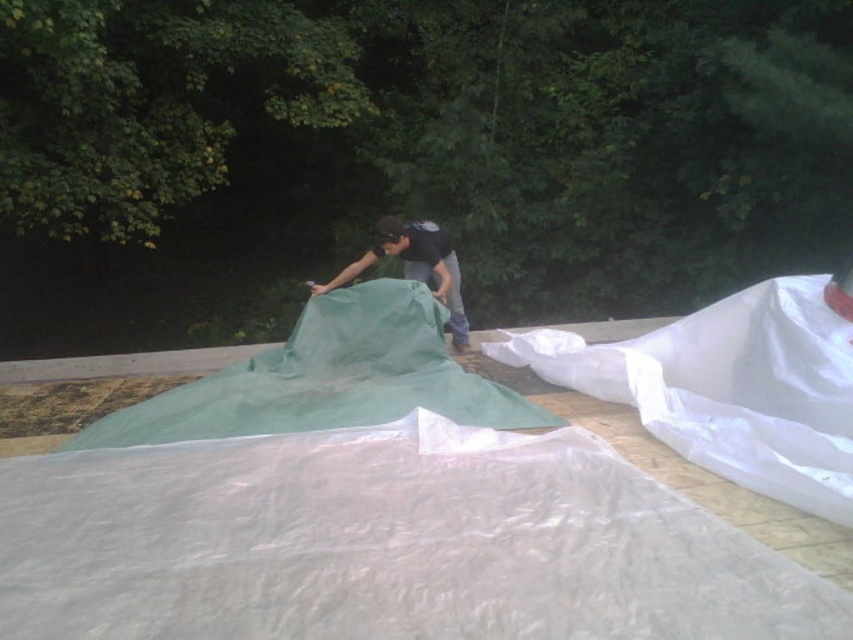
Question: Is white translucent sheet at right positioned behind green fabric blanket at center?

Choices:
 (A) no
 (B) yes

Answer: (A)

Question: Considering the relative positions of white translucent sheet at right and matte green tarp at center in the image provided, where is white translucent sheet at right located with respect to matte green tarp at center?

Choices:
 (A) above
 (B) below

Answer: (B)

Question: Among these points, which one is farthest from the camera?

Choices:
 (A) (276, 362)
 (B) (350, 266)

Answer: (B)

Question: Does white translucent sheet at right have a lesser width compared to green fabric blanket at center?

Choices:
 (A) no
 (B) yes

Answer: (B)

Question: Which point is farther from the camera taking this photo?

Choices:
 (A) (262, 372)
 (B) (321, 552)
 (C) (383, 241)

Answer: (C)

Question: Which object is farther from the camera taking this photo?

Choices:
 (A) matte green tarp at center
 (B) green fabric blanket at center

Answer: (A)